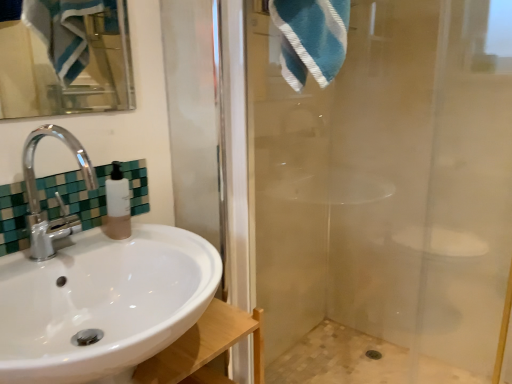
Question: Does beige mosaic tile bath at lower right have a larger size compared to transparent glass shower door at right?

Choices:
 (A) yes
 (B) no

Answer: (B)

Question: From a real-world perspective, is beige mosaic tile bath at lower right under transparent glass shower door at right?

Choices:
 (A) no
 (B) yes

Answer: (B)

Question: Are beige mosaic tile bath at lower right and transparent glass shower door at right far apart?

Choices:
 (A) yes
 (B) no

Answer: (B)

Question: Is beige mosaic tile bath at lower right shorter than transparent glass shower door at right?

Choices:
 (A) no
 (B) yes

Answer: (B)

Question: Is transparent glass shower door at right surrounded by beige mosaic tile bath at lower right?

Choices:
 (A) yes
 (B) no

Answer: (B)

Question: Considering the positions of green mosaic tile at upper left and beige mosaic tile bath at lower right in the image, is green mosaic tile at upper left taller or shorter than beige mosaic tile bath at lower right?

Choices:
 (A) tall
 (B) short

Answer: (A)

Question: In terms of width, does green mosaic tile at upper left look wider or thinner when compared to beige mosaic tile bath at lower right?

Choices:
 (A) wide
 (B) thin

Answer: (B)

Question: Is point (82, 228) positioned closer to the camera than point (337, 324)?

Choices:
 (A) farther
 (B) closer

Answer: (B)

Question: Choose the correct answer: Is green mosaic tile at upper left inside beige mosaic tile bath at lower right or outside it?

Choices:
 (A) inside
 (B) outside

Answer: (B)

Question: Is point (392, 316) positioned closer to the camera than point (114, 162)?

Choices:
 (A) farther
 (B) closer

Answer: (A)

Question: Considering the positions of transparent glass shower door at right and translucent plastic soap dispenser at sink in the image, is transparent glass shower door at right taller or shorter than translucent plastic soap dispenser at sink?

Choices:
 (A) short
 (B) tall

Answer: (B)

Question: Would you say transparent glass shower door at right is to the left or to the right of translucent plastic soap dispenser at sink in the picture?

Choices:
 (A) right
 (B) left

Answer: (A)

Question: From the image's perspective, is transparent glass shower door at right located above or below translucent plastic soap dispenser at sink?

Choices:
 (A) above
 (B) below

Answer: (B)

Question: Relative to white glossy sink at lower left, is beige mosaic tile bath at lower right in front or behind?

Choices:
 (A) front
 (B) behind

Answer: (B)

Question: From a real-world perspective, relative to white glossy sink at lower left, is beige mosaic tile bath at lower right vertically above or below?

Choices:
 (A) below
 (B) above

Answer: (A)